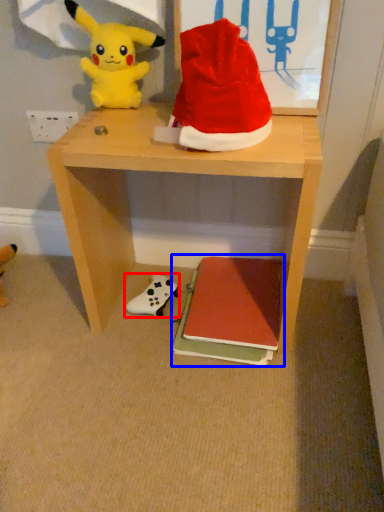
Question: Which object appears farthest to the camera in this image, toy (highlighted by a red box) or book (highlighted by a blue box)?

Choices:
 (A) toy
 (B) book

Answer: (A)